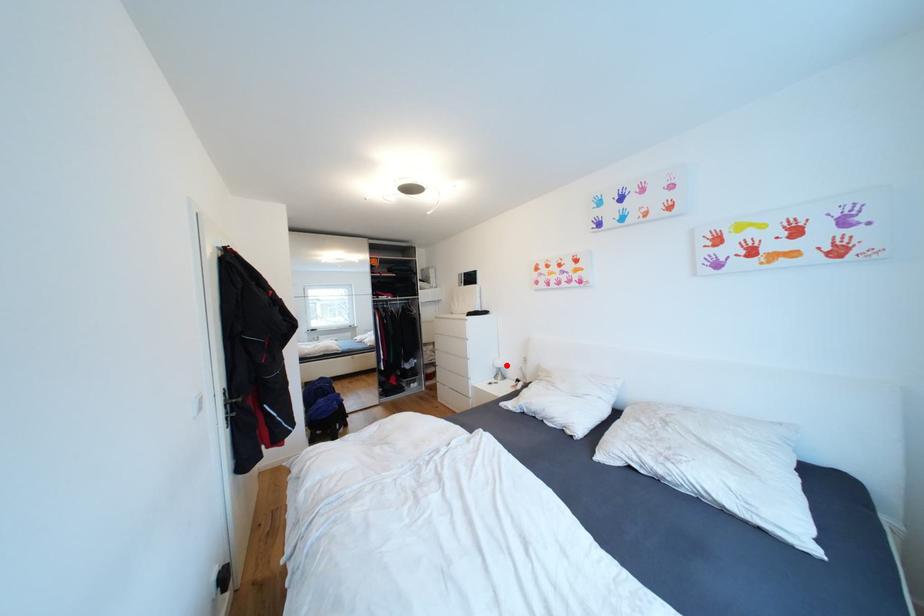
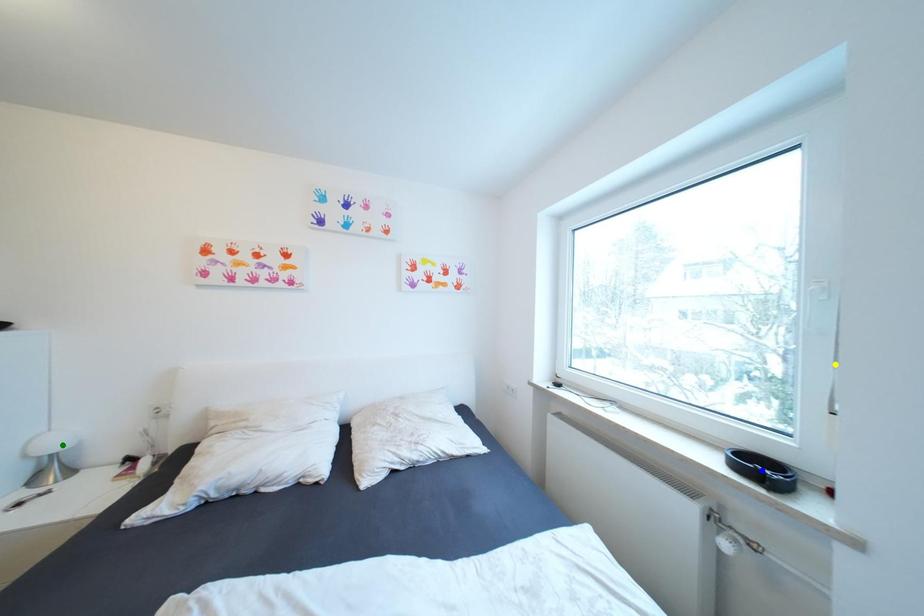
Question: I am providing you with two images of the same scene from different viewpoints. A red point is marked on the first image. You are given multiple points on the second image. Which point in image 2 is actually the same real-world point as the red point in image 1?

Choices:
 (A) blue point
 (B) yellow point
 (C) green point

Answer: (C)